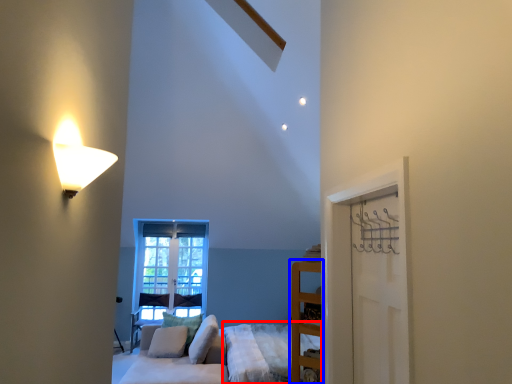
Question: Which point is further to the camera, bed frame (highlighted by a red box) or furniture (highlighted by a blue box)?

Choices:
 (A) bed frame
 (B) furniture

Answer: (A)